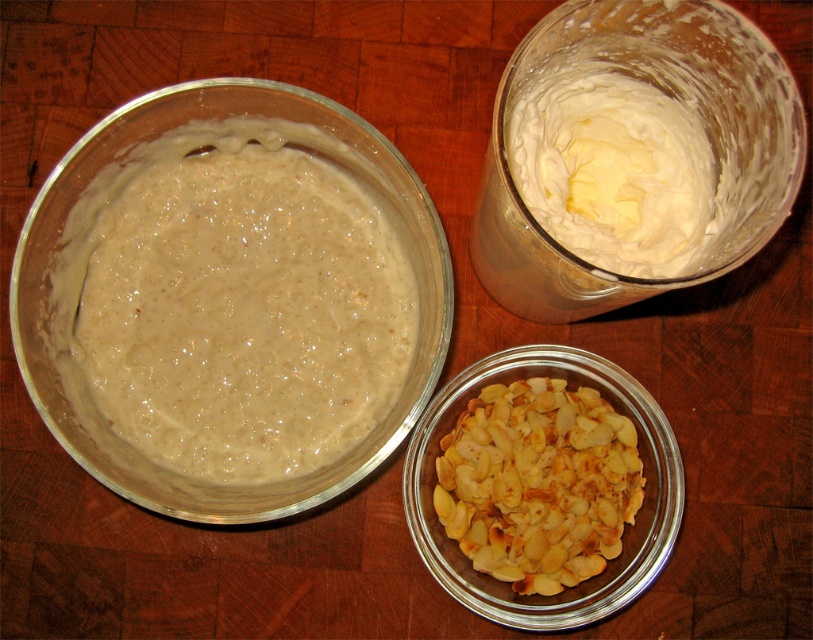
Question: Which point is closer to the camera?

Choices:
 (A) smooth beige batter at upper left
 (B) white creamy butter at upper right
 (C) golden toasted almonds at lower center

Answer: (B)

Question: Which object appears farthest from the camera in this image?

Choices:
 (A) smooth beige batter at upper left
 (B) white creamy butter at upper right

Answer: (A)

Question: Which object is farther from the camera taking this photo?

Choices:
 (A) white creamy butter at upper right
 (B) golden toasted almonds at lower center

Answer: (B)

Question: Is smooth beige batter at upper left thinner than white creamy butter at upper right?

Choices:
 (A) yes
 (B) no

Answer: (B)

Question: Does smooth beige batter at upper left have a smaller size compared to white creamy butter at upper right?

Choices:
 (A) yes
 (B) no

Answer: (B)

Question: Can you confirm if golden toasted almonds at lower center is wider than white creamy butter at upper right?

Choices:
 (A) no
 (B) yes

Answer: (B)